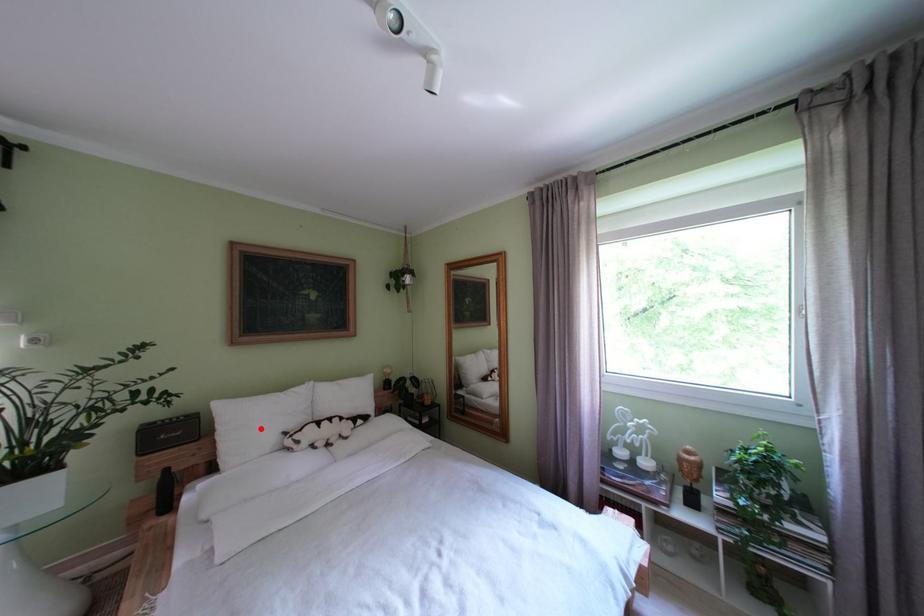
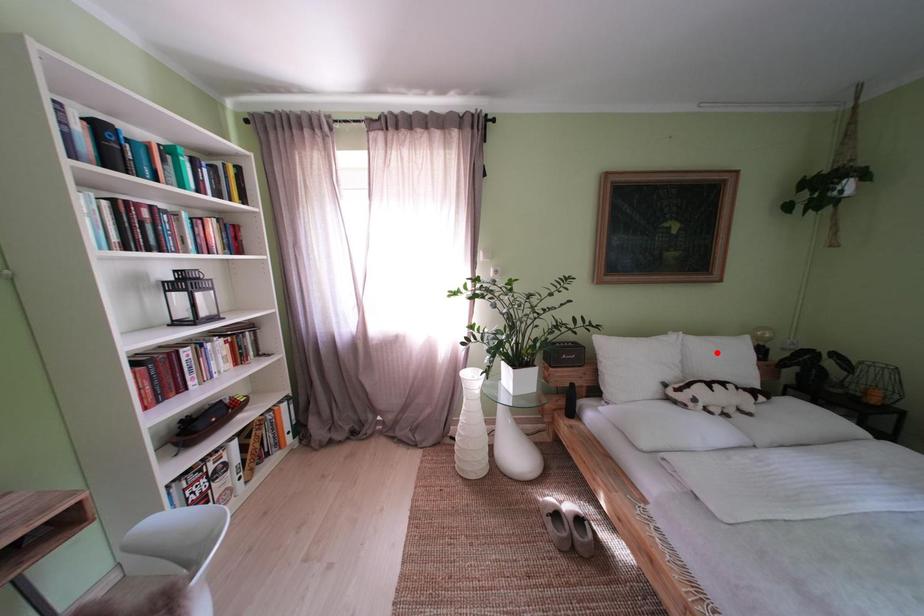
I am providing you with two images of the same scene from different viewpoints. A red point is marked on the first image and another point is marked on the second image. Is the red point in image1 aligned with the point shown in image2?

No